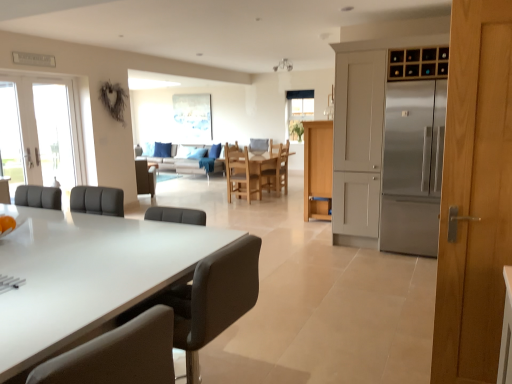
Question: Considering their positions, is black leather chair at center, arranged as the 3th chair when viewed from the right, located in front of or behind wooden chair at center, the 5th chair from the front?

Choices:
 (A) front
 (B) behind

Answer: (A)

Question: Which is correct: black leather chair at center, acting as the 3th chair starting from the left, is inside wooden chair at center, the fifth chair positioned from the left, or outside of it?

Choices:
 (A) inside
 (B) outside

Answer: (B)

Question: Which object is the closest to the wooden chair at center, positioned as the 2th chair in right-to-left order?

Choices:
 (A) light brown wood door at right
 (B) light wood cabinet at center, which appears as the 2th cabinetry when viewed from the right
 (C) matte black chair at lower left, the fourth chair viewed from the right
 (D) white glass door at left
 (E) brown leather chair at center, placed as the fourth chair when sorted from front to back

Answer: (B)

Question: Considering the real-world distances, which object is farthest from the wooden chair at center, arranged as the third chair when viewed from the back?

Choices:
 (A) light wood cabinet at center, the 1th cabinetry when ordered from left to right
 (B) matte black chair at lower left, acting as the 2th chair starting from the left
 (C) wooden chair at center, which is counted as the first chair, starting from the back
 (D) black leather chair at center, marked as the fourth chair in a back-to-front arrangement
 (E) brown leather chair at center, the 1th chair viewed from the left

Answer: (B)